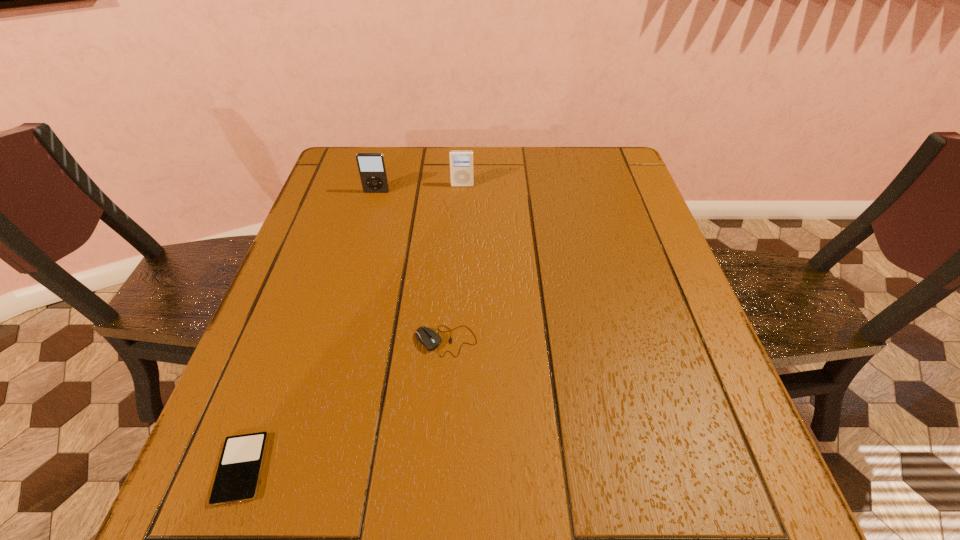
The height and width of the screenshot is (540, 960). Identify the location of blank space at the far right corner. (624, 165).

Locate an element on the screen. This screenshot has height=540, width=960. blank region between the shortest iPod and the computer mouse is located at coordinates (344, 405).

This screenshot has height=540, width=960. Find the location of `vacant space that's between the nearest object and the rightmost iPod`. vacant space that's between the nearest object and the rightmost iPod is located at coordinates (352, 327).

The height and width of the screenshot is (540, 960). What are the coordinates of `vacant region between the second object from left to right and the shortest iPod` in the screenshot? It's located at (309, 330).

Where is `free space between the shortest iPod and the second shortest object`? free space between the shortest iPod and the second shortest object is located at coordinates [344, 405].

Where is `unoccupied area between the second nearest object and the second iPod from right to left`? unoccupied area between the second nearest object and the second iPod from right to left is located at coordinates (411, 267).

The image size is (960, 540). I want to click on free area in between the farthest iPod and the computer mouse, so click(454, 264).

I want to click on free area in between the second nearest object and the farthest iPod, so click(x=454, y=264).

Where is `vacant space that's between the shortest object and the farthest iPod`? The width and height of the screenshot is (960, 540). vacant space that's between the shortest object and the farthest iPod is located at coordinates coord(352,327).

I want to click on blank region between the third object from right to left and the farthest iPod, so click(420, 189).